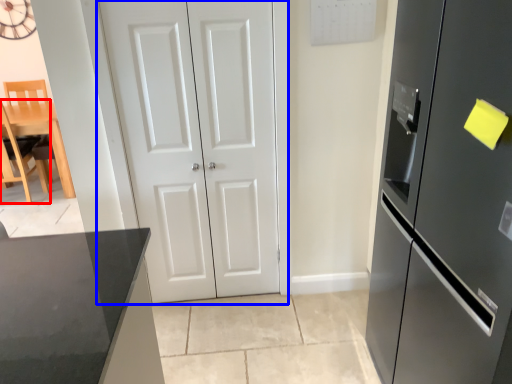
Question: Which object appears closest to the camera in this image, chair (highlighted by a red box) or door (highlighted by a blue box)?

Choices:
 (A) chair
 (B) door

Answer: (B)